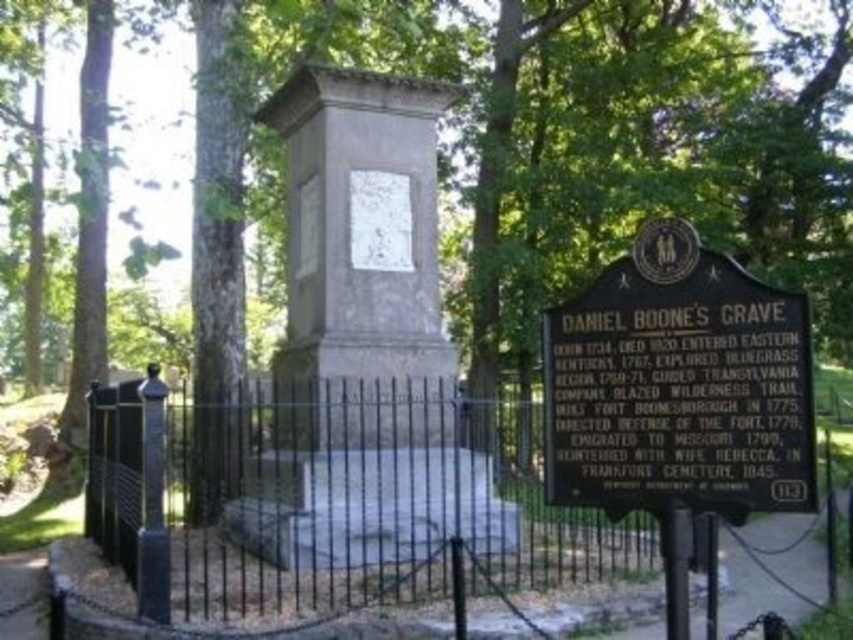
Is point (408, 336) farther from camera compared to point (576, 316)?

Yes, it is.

Is point (378, 198) closer to viewer compared to point (618, 436)?

No, it is behind (618, 436).

Is point (422, 230) closer to camera compared to point (627, 257)?

No, (422, 230) is behind (627, 257).

Identify the location of gray stone monument at center. The width and height of the screenshot is (853, 640). (364, 330).